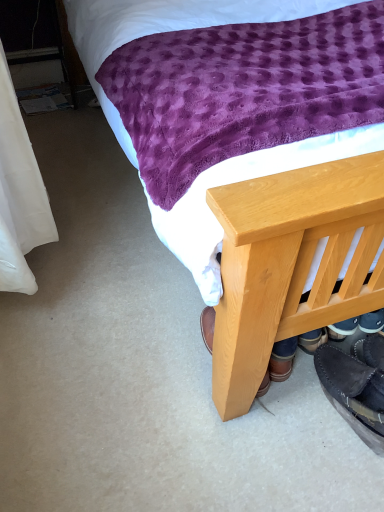
Question: Is point (354, 181) positioned closer to the camera than point (380, 338)?

Choices:
 (A) closer
 (B) farther

Answer: (A)

Question: From the image's perspective, relative to black suede shoes at lower right, acting as the 2th footwear starting from the left, is wooden bed frame at lower right above or below?

Choices:
 (A) above
 (B) below

Answer: (A)

Question: Which object is positioned farthest from the wooden bed frame at lower right?

Choices:
 (A) black suede moccasin at lower right, which appears as the 2th footwear when viewed from the right
 (B) black suede shoes at lower right, acting as the 2th footwear starting from the left

Answer: (B)

Question: Estimate the real-world distances between objects in this image. Which object is farther from the wooden bed frame at lower right?

Choices:
 (A) black suede moccasin at lower right, which appears as the 2th footwear when viewed from the right
 (B) black suede shoes at lower right, which is the 1th footwear in right-to-left order

Answer: (B)